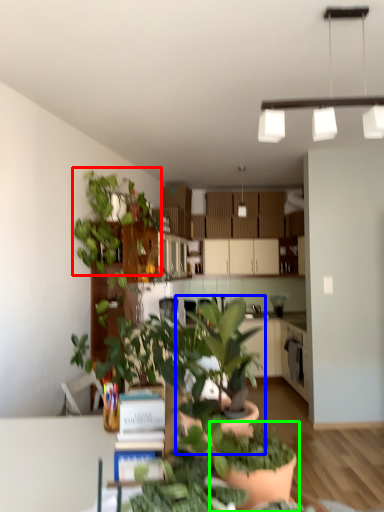
Question: Which is farther away from houseplant (highlighted by a red box)? houseplant (highlighted by a blue box) or houseplant (highlighted by a green box)?

Choices:
 (A) houseplant
 (B) houseplant

Answer: (B)